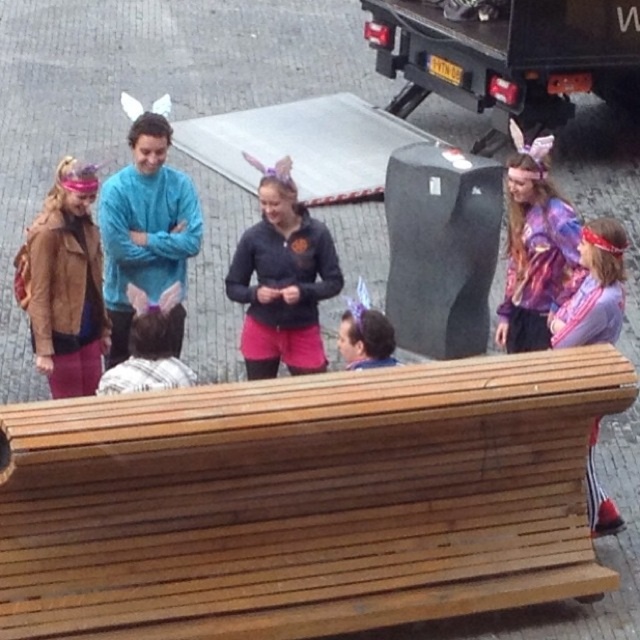
You are standing at the origin point of the scene. Which object is located at the coordinates point (282, 280)?

The point (282, 280) corresponds to the dark gray fleece jacket at center.